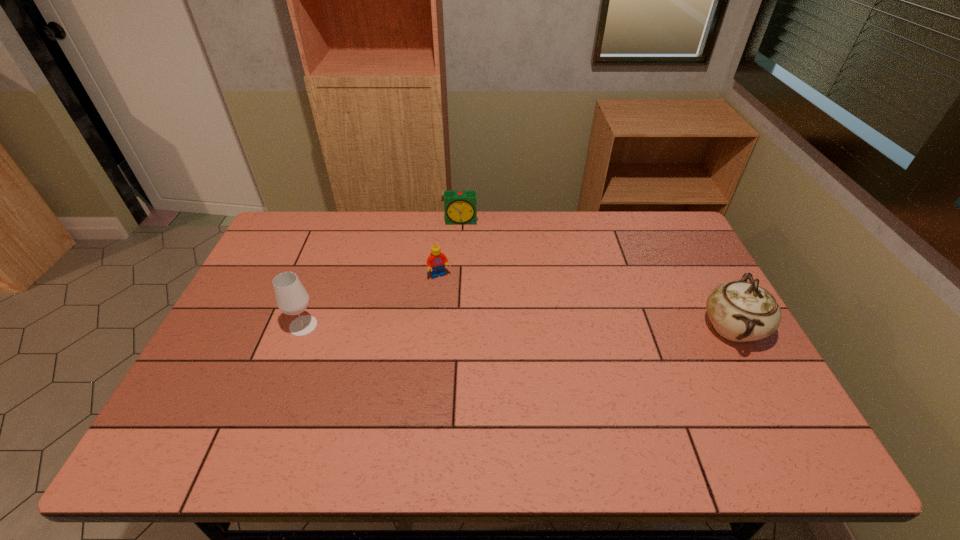
Find the location of a particular element. This screenshot has width=960, height=540. glass is located at coordinates (292, 298).

At what (x,y) coordinates should I click in order to perform the action: click on the rightmost object. Please return your answer as a coordinate pair (x, y). The image size is (960, 540). Looking at the image, I should click on (740, 311).

At what (x,y) coordinates should I click in order to perform the action: click on the farthest object. Please return your answer as a coordinate pair (x, y). Looking at the image, I should click on (460, 207).

You are a GUI agent. You are given a task and a screenshot of the screen. Output one action in this format:
    pyautogui.click(x=<x>, y=<y>)
    Task: Click on the third nearest object
    
    Given the screenshot: What is the action you would take?
    pyautogui.click(x=435, y=262)

The height and width of the screenshot is (540, 960). What are the coordinates of `free location located 0.300m on the right of the glass` in the screenshot? It's located at (425, 326).

Find the location of a particular element. This screenshot has width=960, height=540. vacant space positioned on the left of the rightmost object is located at coordinates (646, 328).

Identify the location of vacant region located 0.400m on the front-facing side of the farthest object. This screenshot has width=960, height=540. (460, 307).

I want to click on vacant space located 0.270m on the front-facing side of the farthest object, so click(x=461, y=276).

Locate an element on the screen. This screenshot has width=960, height=540. free point located on the front-facing side of the farthest object is located at coordinates (461, 264).

At what (x,y) coordinates should I click in order to perform the action: click on vacant point located 0.050m on the face of the Lego. Please return your answer as a coordinate pair (x, y). Image resolution: width=960 pixels, height=540 pixels. Looking at the image, I should click on (448, 293).